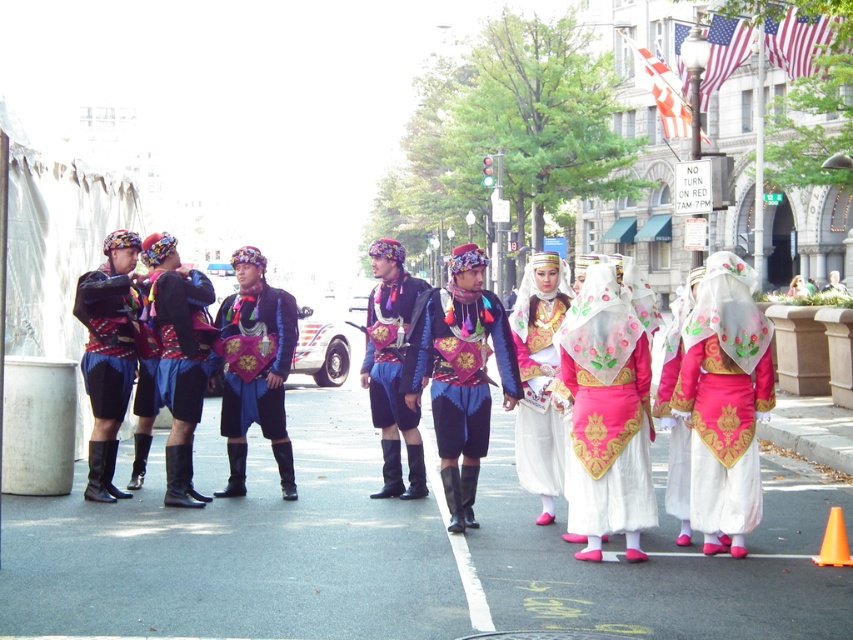
This screenshot has height=640, width=853. What do you see at coordinates (108, 339) in the screenshot?
I see `velvet blue shorts at left` at bounding box center [108, 339].

Is velvet blue shorts at left further to the viewer compared to silky white veil at center?

No, it is in front of silky white veil at center.

Where is `velvet blue shorts at left`? Image resolution: width=853 pixels, height=640 pixels. velvet blue shorts at left is located at coordinates (108, 339).

Locate an element on the screen. velvet blue shorts at left is located at coordinates (108, 339).

Is matte pink fabric dress at center shorter than velvet blue shorts at left?

No.

Between matte pink fabric dress at center and velvet blue shorts at left, which one is positioned lower?

Positioned lower is matte pink fabric dress at center.

Is point (605, 449) behind point (94, 380)?

No.

Where is `matte pink fabric dress at center`? The height and width of the screenshot is (640, 853). matte pink fabric dress at center is located at coordinates (605, 416).

In the scene shown: Is matte black boots at left behind silky white veil at center?

No, it is in front of silky white veil at center.

Does point (445, 490) lie behind point (840, 282)?

No.

Which is behind, point (498, 317) or point (827, 289)?

Positioned behind is point (827, 289).

Image resolution: width=853 pixels, height=640 pixels. I want to click on matte black boots at left, so click(252, 376).